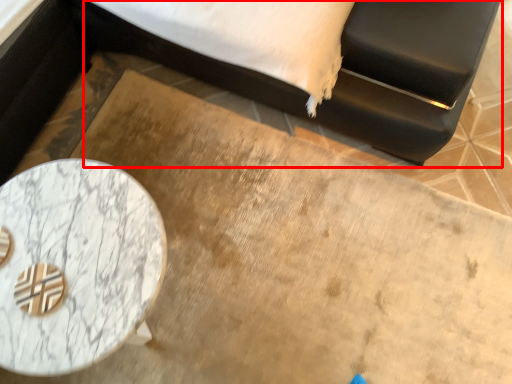
Question: Observing the image, what is the correct spatial positioning of bed (annotated by the red box) in reference to table?

Choices:
 (A) left
 (B) right

Answer: (B)